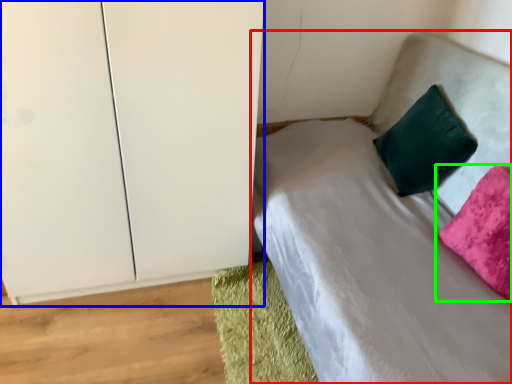
Question: Estimate the real-world distances between objects in this image. Which object is closer to bed (highlighted by a red box), dresser (highlighted by a blue box) or pillow (highlighted by a green box)?

Choices:
 (A) dresser
 (B) pillow

Answer: (B)